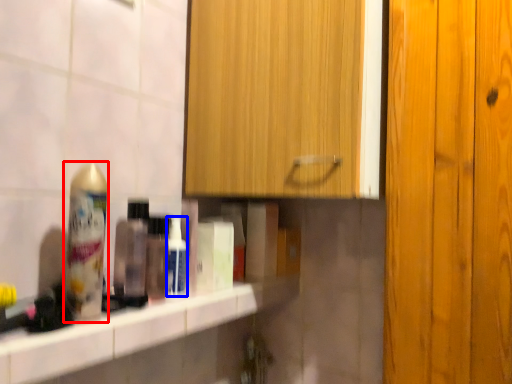
Question: Among these objects, which one is farthest to the camera, shaving cream (highlighted by a red box) or mouthwash (highlighted by a blue box)?

Choices:
 (A) shaving cream
 (B) mouthwash

Answer: (B)